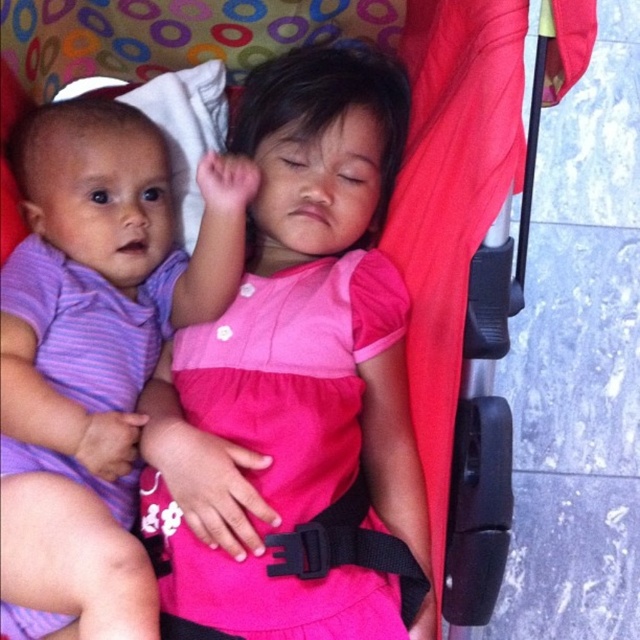
Which is more to the left, pink fabric dress at center or purple striped fabric at left?

From the viewer's perspective, purple striped fabric at left appears more on the left side.

Is pink fabric dress at center thinner than purple striped fabric at left?

Incorrect, pink fabric dress at center's width is not less than purple striped fabric at left's.

Identify the location of pink fabric dress at center. This screenshot has height=640, width=640. (298, 381).

Locate an element on the screen. Image resolution: width=640 pixels, height=640 pixels. pink fabric dress at center is located at coordinates (298, 381).